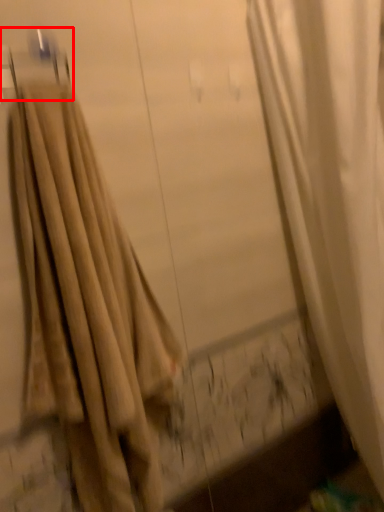
Question: From the image's perspective, where is hanger (annotated by the red box) located relative to curtain?

Choices:
 (A) above
 (B) below

Answer: (A)